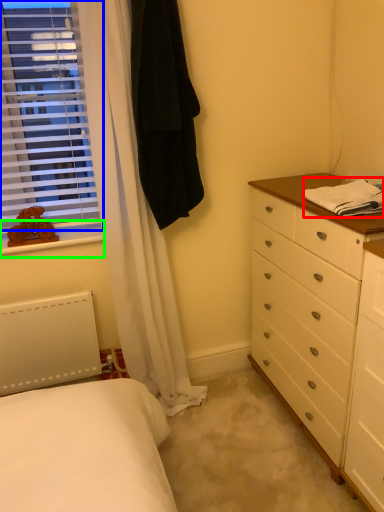
Question: Considering the real-world distances, which object is farthest from blanket (highlighted by a red box)? window (highlighted by a blue box) or window sill (highlighted by a green box)?

Choices:
 (A) window
 (B) window sill

Answer: (A)